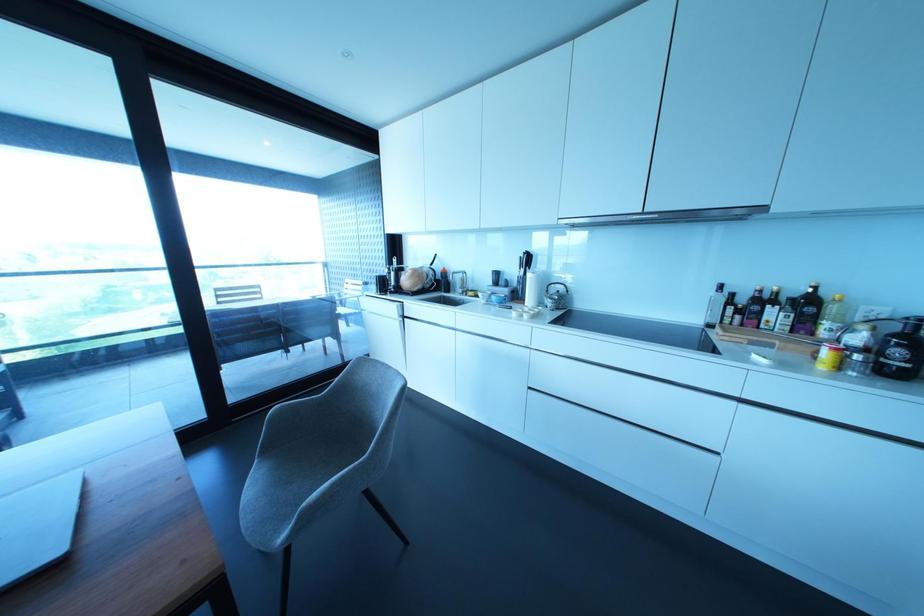
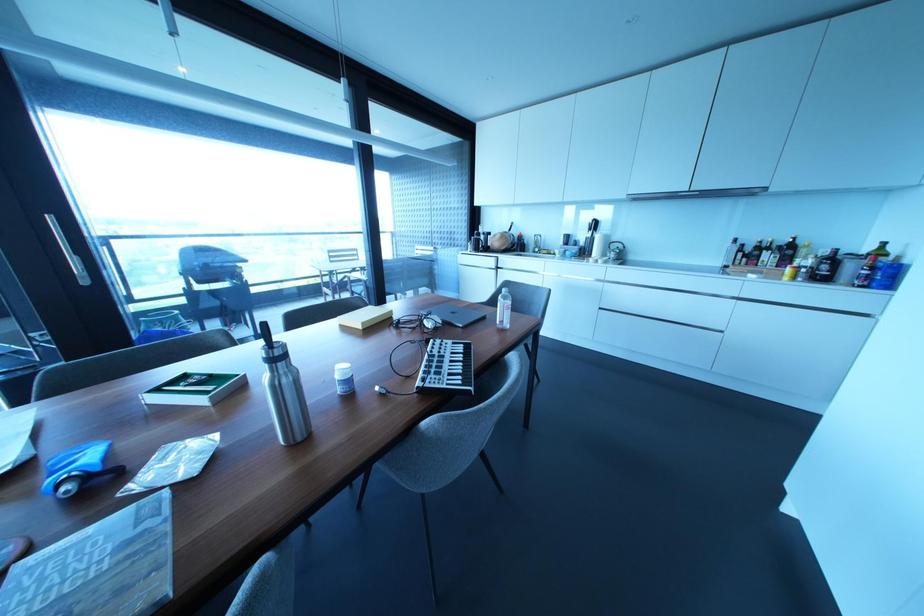
Which direction would the cameraman need to move to produce the second image?

The cameraman walked toward left, backward.